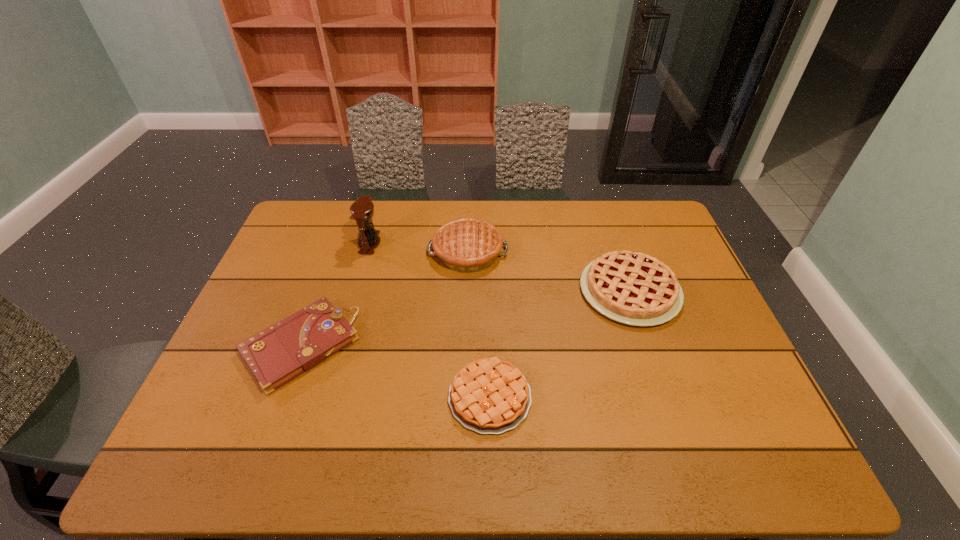
Locate an element on the screen. vacant space at the near left corner of the desktop is located at coordinates (214, 441).

The height and width of the screenshot is (540, 960). I want to click on free area in between the tallest object and the second shortest pie, so click(x=500, y=267).

The width and height of the screenshot is (960, 540). I want to click on blank region between the nearest pie and the notebook, so click(396, 371).

Find the location of a particular element. This screenshot has width=960, height=540. unoccupied position between the fourth shortest object and the shortest pie is located at coordinates (479, 324).

What are the coordinates of `vacant point located between the tallest pie and the rightmost object` in the screenshot? It's located at (549, 272).

Where is `blank region between the notebook and the hourglass`? The height and width of the screenshot is (540, 960). blank region between the notebook and the hourglass is located at coordinates (335, 294).

The height and width of the screenshot is (540, 960). Identify the location of vacant region between the notebook and the hourglass. (335, 294).

Locate an element on the screen. vacant area that lies between the nearest pie and the notebook is located at coordinates (396, 371).

The image size is (960, 540). Identify the location of free space between the notebook and the rightmost object. (465, 319).

The height and width of the screenshot is (540, 960). In order to click on empty space between the tallest object and the notebook in this screenshot , I will do `click(335, 294)`.